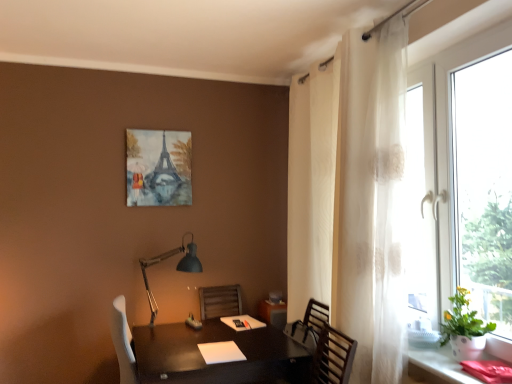
I want to click on white sheer curtain at right, so click(x=353, y=197).

You are a GUI agent. You are given a task and a screenshot of the screen. Output one action in this format:
    pyautogui.click(x=<x>, y=<y>)
    Task: Click on the matte black desk at lower right
    The image size is (512, 384).
    Given the screenshot: What is the action you would take?
    coord(437,366)

This screenshot has width=512, height=384. Describe the element at coordinates (446, 146) in the screenshot. I see `transparent glass window at right` at that location.

Locate an element on the screen. The image size is (512, 384). white sheer curtain at right is located at coordinates (353, 197).

Which object is closer to the camera taking this photo, white sheer curtain at right or green leafy plant at right?

green leafy plant at right is in front.

What's the angular difference between white sheer curtain at right and green leafy plant at right's facing directions?

2.02 degrees separate the facing orientations of white sheer curtain at right and green leafy plant at right.

From a real-world perspective, is white sheer curtain at right positioned under green leafy plant at right based on gravity?

No, from a real-world perspective, white sheer curtain at right is not beneath green leafy plant at right.

Which is nearer, [341,119] or [464,346]?

Point [341,119].

From a real-world perspective, is watercolor paper painting of eiffel tower at upper center positioned over shiny dark wood table at center based on gravity?

Yes, from a real-world perspective, watercolor paper painting of eiffel tower at upper center is above shiny dark wood table at center.

Is watercolor paper painting of eiffel tower at upper center closer to camera compared to shiny dark wood table at center?

That is False.

Which of these two, watercolor paper painting of eiffel tower at upper center or shiny dark wood table at center, stands taller?

watercolor paper painting of eiffel tower at upper center is taller.

Is matte black desk at lower right surrounded by matte black lamp at lower left?

No, matte black desk at lower right is located outside of matte black lamp at lower left.

Considering the relative sizes of matte black lamp at lower left and matte black desk at lower right in the image provided, is matte black lamp at lower left taller than matte black desk at lower right?

Yes, matte black lamp at lower left is taller than matte black desk at lower right.

Is point (194, 262) closer or farther from the camera than point (444, 353)?

Clearly, point (194, 262) is more distant from the camera than point (444, 353).

From a real-world perspective, is watercolor paper painting of eiffel tower at upper center located higher than green leafy plant at right?

Yes.

Does watercolor paper painting of eiffel tower at upper center have a lesser width compared to green leafy plant at right?

Correct, the width of watercolor paper painting of eiffel tower at upper center is less than that of green leafy plant at right.

In the scene shown: Is watercolor paper painting of eiffel tower at upper center oriented away from green leafy plant at right?

No, watercolor paper painting of eiffel tower at upper center is not facing the opposite direction of green leafy plant at right.

From the image's perspective, which is below, watercolor paper painting of eiffel tower at upper center or green leafy plant at right?

From the image's view, green leafy plant at right is below.

How different are the orientations of transparent glass window at right and matte black desk at lower right in degrees?

The angular difference between transparent glass window at right and matte black desk at lower right is 1.19 degrees.

Is transparent glass window at right positioned with its back to matte black desk at lower right?

No, transparent glass window at right is not facing the opposite direction of matte black desk at lower right.

Considering the points (430, 217) and (423, 361), which point is in front, point (430, 217) or point (423, 361)?

The point (423, 361) is closer to the camera.

Which object is positioned more to the right, shiny dark wood table at center or matte black lamp at lower left?

shiny dark wood table at center is more to the right.

From the picture: Which object is further away from the camera taking this photo, shiny dark wood table at center or matte black lamp at lower left?

matte black lamp at lower left is further away from the camera.

How many degrees apart are the facing directions of shiny dark wood table at center and matte black lamp at lower left?

The angle between the facing direction of shiny dark wood table at center and the facing direction of matte black lamp at lower left is 4.03 degrees.

Does point (238, 381) appear closer or farther from the camera than point (146, 289)?

Point (238, 381) is positioned closer to the camera compared to point (146, 289).

Can we say green leafy plant at right lies outside watercolor paper painting of eiffel tower at upper center?

Yes, green leafy plant at right is not within watercolor paper painting of eiffel tower at upper center.

Can you confirm if green leafy plant at right is bigger than watercolor paper painting of eiffel tower at upper center?

Yes.

Looking at this image, how different are the orientations of green leafy plant at right and watercolor paper painting of eiffel tower at upper center in degrees?

The facing directions of green leafy plant at right and watercolor paper painting of eiffel tower at upper center are 91.2 degrees apart.

How much distance is there between green leafy plant at right and watercolor paper painting of eiffel tower at upper center?

green leafy plant at right and watercolor paper painting of eiffel tower at upper center are 2.07 meters apart from each other.

This screenshot has width=512, height=384. I want to click on houseplant on the right of the white sheer curtain at right, so click(x=464, y=328).

This screenshot has height=384, width=512. In order to click on table below the watercolor paper painting of eiffel tower at upper center (from the image's perspective) in this screenshot , I will do `click(220, 363)`.

When comparing their distances from transparent glass window at right, does matte black desk at lower right or watercolor paper painting of eiffel tower at upper center seem further?

watercolor paper painting of eiffel tower at upper center is further to transparent glass window at right.

Considering their positions, is transparent glass window at right positioned further to watercolor paper painting of eiffel tower at upper center than white sheer curtain at right?

The object further to watercolor paper painting of eiffel tower at upper center is transparent glass window at right.

Looking at the image, which one is located closer to matte black desk at lower right, transparent glass window at right or watercolor paper painting of eiffel tower at upper center?

transparent glass window at right lies closer to matte black desk at lower right than the other object.

Looking at the image, which one is located closer to green leafy plant at right, white sheer curtain at right or shiny dark wood table at center?

Based on the image, white sheer curtain at right appears to be nearer to green leafy plant at right.

Estimate the real-world distances between objects in this image. Which object is closer to transparent glass window at right, green leafy plant at right or white sheer curtain at right?

Based on the image, white sheer curtain at right appears to be nearer to transparent glass window at right.

From the image, which object appears to be nearer to matte black desk at lower right, matte black lamp at lower left or green leafy plant at right?

green leafy plant at right.

Estimate the real-world distances between objects in this image. Which object is closer to matte black desk at lower right, shiny dark wood table at center or green leafy plant at right?

Among the two, green leafy plant at right is located nearer to matte black desk at lower right.

Estimate the real-world distances between objects in this image. Which object is closer to shiny dark wood table at center, watercolor paper painting of eiffel tower at upper center or green leafy plant at right?

Based on the image, green leafy plant at right appears to be nearer to shiny dark wood table at center.

Where is `computer desk between matte black lamp at lower left and green leafy plant at right`? This screenshot has height=384, width=512. computer desk between matte black lamp at lower left and green leafy plant at right is located at coordinates (437, 366).

Identify the location of curtain between transparent glass window at right and matte black desk at lower right vertically. (353, 197).

The width and height of the screenshot is (512, 384). What are the coordinates of `table lamp between watercolor paper painting of eiffel tower at upper center and matte black desk at lower right in the horizontal direction` in the screenshot? It's located at (176, 268).

Locate an element on the screen. The image size is (512, 384). curtain situated between matte black lamp at lower left and green leafy plant at right from left to right is located at coordinates (353, 197).